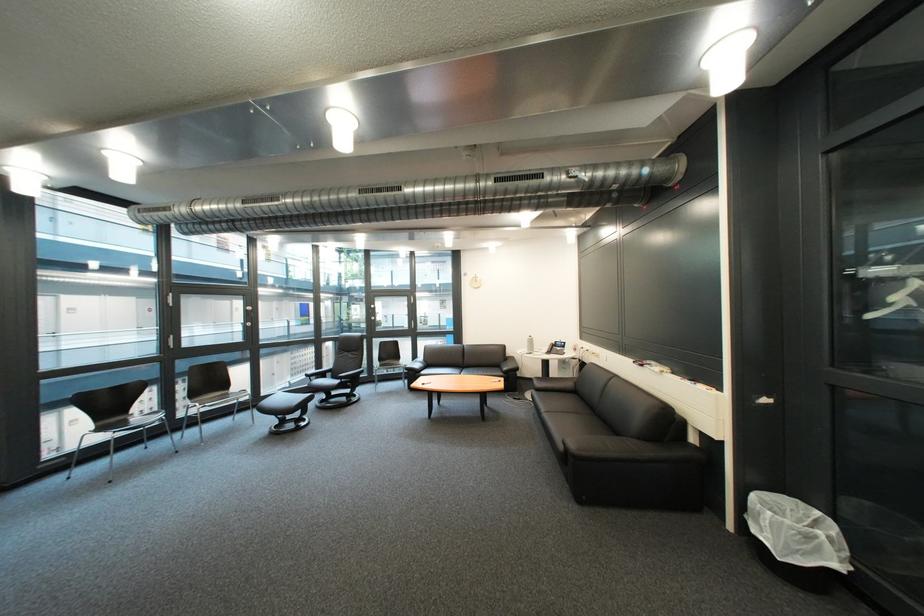
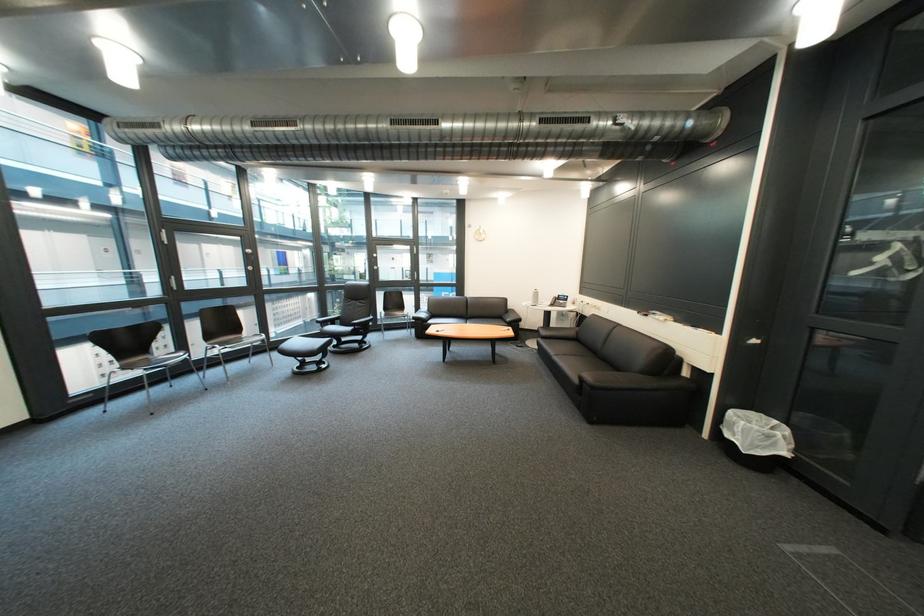
Locate, in the second image, the point that corresponds to (x=353, y=385) in the first image.

(366, 331)